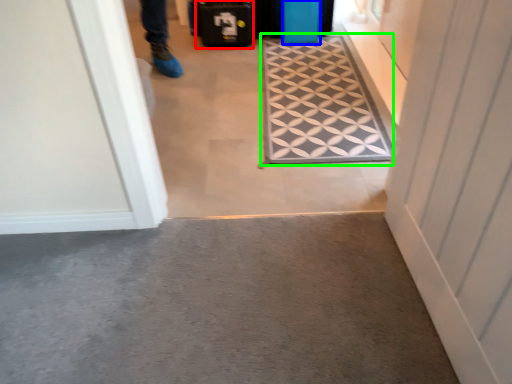
Question: Which is farther away from luggage (highlighted by a red box)? luggage (highlighted by a blue box) or doormat (highlighted by a green box)?

Choices:
 (A) luggage
 (B) doormat

Answer: (B)